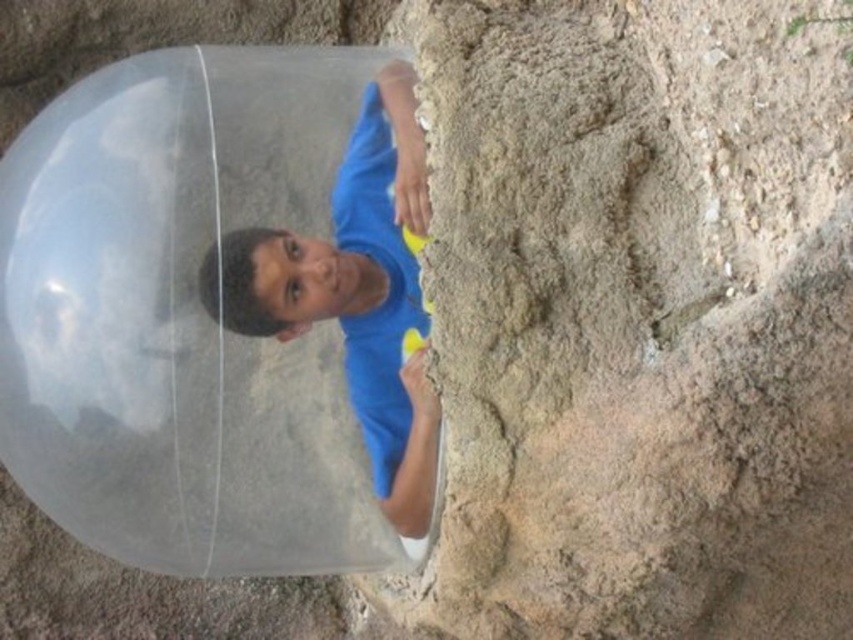
Question: Where is transparent plastic bubble at center located in relation to blue matte shirt at center in the image?

Choices:
 (A) left
 (B) right

Answer: (A)

Question: Can you confirm if transparent plastic bubble at center is bigger than blue matte shirt at center?

Choices:
 (A) yes
 (B) no

Answer: (A)

Question: In this image, where is transparent plastic bubble at center located relative to blue matte shirt at center?

Choices:
 (A) below
 (B) above

Answer: (A)